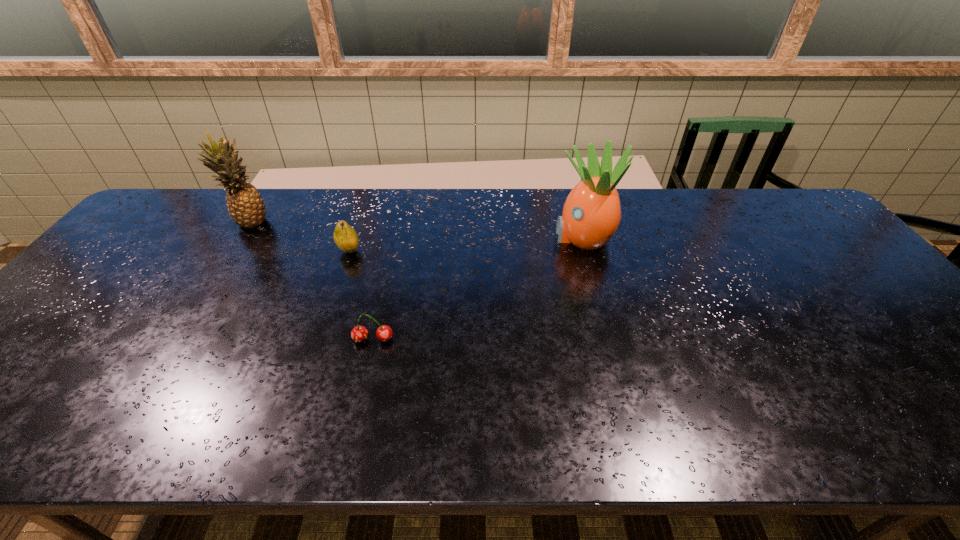
Where is `empty location between the third tallest object and the right pineapple`? The image size is (960, 540). empty location between the third tallest object and the right pineapple is located at coordinates (466, 244).

Identify the location of empty space that is in between the right pineapple and the second shortest object. The height and width of the screenshot is (540, 960). (466, 244).

This screenshot has width=960, height=540. In order to click on empty location between the third tallest object and the right pineapple in this screenshot , I will do `click(466, 244)`.

Where is `free space between the third tallest object and the right pineapple`? This screenshot has height=540, width=960. free space between the third tallest object and the right pineapple is located at coordinates [466, 244].

At what (x,y) coordinates should I click in order to perform the action: click on free space between the right pineapple and the cherry. Please return your answer as a coordinate pair (x, y). Looking at the image, I should click on (478, 288).

Identify the location of free spot between the rightmost object and the cherry. (478, 288).

Find the location of `free space between the rightmost object and the third object from left to right`. free space between the rightmost object and the third object from left to right is located at coordinates (478, 288).

Identify which object is the second nearest to the rightmost object. Please provide its 2D coordinates. Your answer should be formatted as a tuple, i.e. [(x, y)], where the tuple contains the x and y coordinates of a point satisfying the conditions above.

[(346, 238)]

Locate an element on the screen. The width and height of the screenshot is (960, 540). the second closest object to the second shortest object is located at coordinates (359, 333).

The height and width of the screenshot is (540, 960). In order to click on free space in the image that satisfies the following two spatial constraints: 1. on the front side of the third tallest object; 2. on the right side of the leftmost object in this screenshot , I will do `click(232, 251)`.